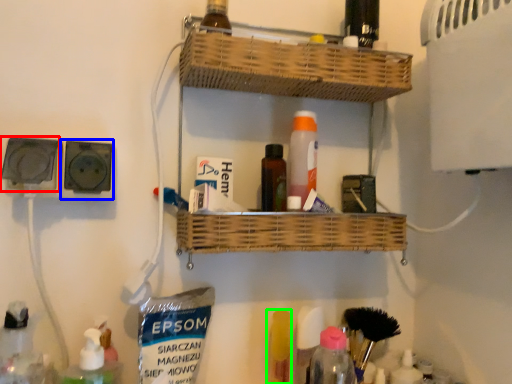
Question: Considering the real-world distances, which object is farthest from electric outlet (highlighted by a red box)? electric outlet (highlighted by a blue box) or toiletry (highlighted by a green box)?

Choices:
 (A) electric outlet
 (B) toiletry

Answer: (B)